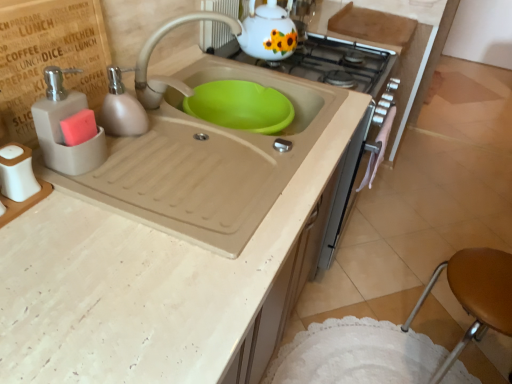
Where is `empty space that is ontop of beige matte sink at center (from a real-world perspective)`? The width and height of the screenshot is (512, 384). empty space that is ontop of beige matte sink at center (from a real-world perspective) is located at coordinates (194, 144).